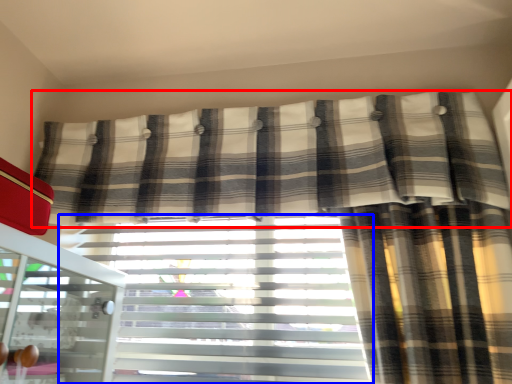
Question: Which of the following is the farthest to the observer, curtain (highlighted by a red box) or window blind (highlighted by a blue box)?

Choices:
 (A) curtain
 (B) window blind

Answer: (B)